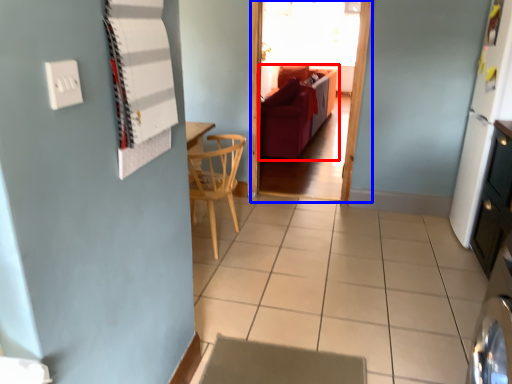
Question: Among these objects, which one is nearest to the camera, studio couch (highlighted by a red box) or glass door (highlighted by a blue box)?

Choices:
 (A) studio couch
 (B) glass door

Answer: (B)